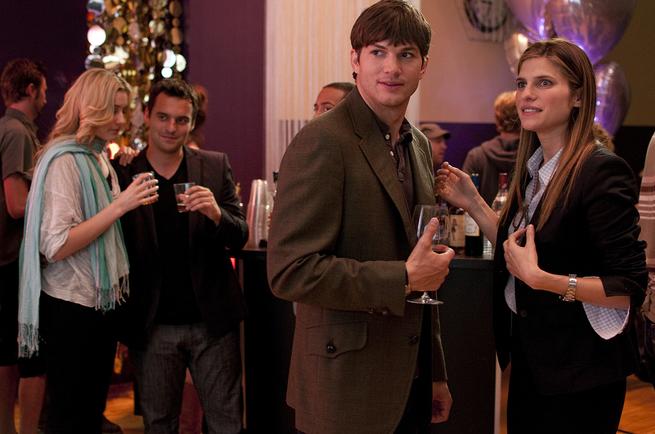
You are a GUI agent. You are given a task and a screenshot of the screen. Output one action in this format:
    pyautogui.click(x=<x>, y=<y>)
    Task: Click on the bar
    This screenshot has width=655, height=434.
    Given the screenshot: What is the action you would take?
    pyautogui.click(x=257, y=251)